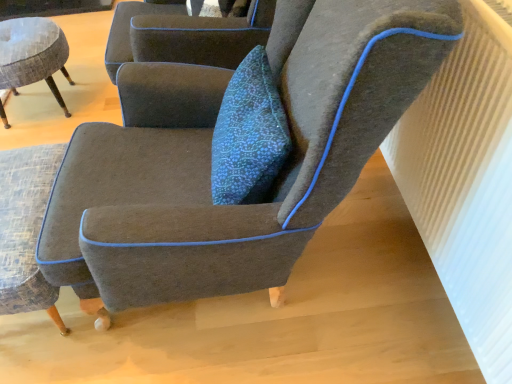
The width and height of the screenshot is (512, 384). Identify the location of empty space that is in between dark gray fabric chair at center, which is the 1th chair in right-to-left order, and white ribbed radiator at upper right. (386, 279).